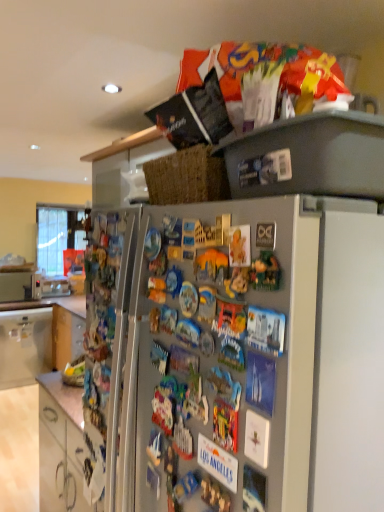
Question: Is metallic silver microwave at left in front of or behind white glossy cabinet at lower left, which is the 1th cabinetry in bottom-to-top order, in the image?

Choices:
 (A) behind
 (B) front

Answer: (A)

Question: Based on their positions, is metallic silver microwave at left located to the left or right of white glossy cabinet at lower left, acting as the second cabinetry starting from the top?

Choices:
 (A) right
 (B) left

Answer: (B)

Question: Which object is the closest to the white glossy cabinet at lower left, positioned as the second cabinetry in front-to-back order?

Choices:
 (A) metallic silver microwave at left
 (B) white glossy cabinet at lower left, which is the 1th cabinetry in bottom-to-top order
 (C) satin silver fridge at upper center

Answer: (A)

Question: Which of these objects is positioned closest to the white glossy cabinet at lower left, positioned as the second cabinetry in front-to-back order?

Choices:
 (A) metallic silver microwave at left
 (B) white glossy cabinet at lower left, which appears as the first cabinetry when viewed from the front
 (C) satin silver fridge at upper center

Answer: (A)